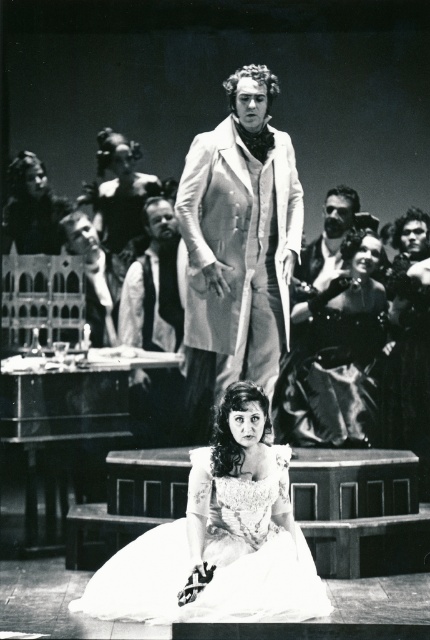
You are a stagehand in this scene. You need to retrieve the silvery metallic coat at center from its current position. What is the exact coordinate where you should look to find it?

The silvery metallic coat at center is located at point (239,243), so you should look there to find it.

You are an assistant helping to stage the play. The director wants to ensure the silvery metallic coat at center is positioned precisely. Given the coordinates provided, can you confirm its exact location relative to the woman in the white gown and the man in the light suit?

The silvery metallic coat at center is located at point coordinates (239, 243), which places it centrally in the scene between the woman in the white gown and the man in the light suit.